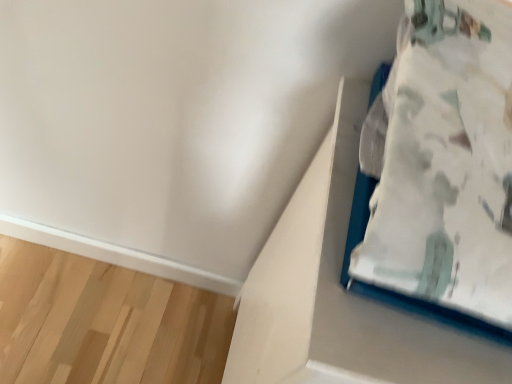
What is the approximate width of white fabric bed at upper right?

white fabric bed at upper right is 13.35 inches wide.

At what (x,y) coordinates should I click in order to perform the action: click on white fabric bed at upper right. Please return your answer as a coordinate pair (x, y). The width and height of the screenshot is (512, 384). Looking at the image, I should click on [x=444, y=166].

In order to face white fabric bed at upper right, should I rotate leftwards or rightwards?

You should rotate right by 28.398 degrees.

The height and width of the screenshot is (384, 512). Describe the element at coordinates (444, 166) in the screenshot. I see `white fabric bed at upper right` at that location.

Measure the distance between white matte cardboard box at upper right and camera.

white matte cardboard box at upper right and camera are 14.36 inches apart from each other.

This screenshot has width=512, height=384. Describe the element at coordinates (339, 294) in the screenshot. I see `white matte cardboard box at upper right` at that location.

Identify the location of white matte cardboard box at upper right. The image size is (512, 384). (339, 294).

At what (x,y) coordinates should I click in order to perform the action: click on white fabric bed at upper right. Please return your answer as a coordinate pair (x, y). The height and width of the screenshot is (384, 512). Looking at the image, I should click on (444, 166).

Based on their positions, is white fabric bed at upper right located to the left or right of white matte cardboard box at upper right?

white fabric bed at upper right is positioned on white matte cardboard box at upper right's left side.

Is the depth of white fabric bed at upper right less than that of white matte cardboard box at upper right?

A: Yes, it is in front of white matte cardboard box at upper right.

Considering the points (389, 222) and (302, 373), which point is behind, point (389, 222) or point (302, 373)?

The point (302, 373) is farther.

From the image's perspective, is white fabric bed at upper right above or below white matte cardboard box at upper right?

white fabric bed at upper right is above white matte cardboard box at upper right.

From a real-world perspective, is white fabric bed at upper right located beneath white matte cardboard box at upper right?

No, from a real-world perspective, white fabric bed at upper right is not beneath white matte cardboard box at upper right.

Considering the sizes of objects white fabric bed at upper right and white matte cardboard box at upper right in the image provided, who is thinner, white fabric bed at upper right or white matte cardboard box at upper right?

white fabric bed at upper right is thinner.

Considering the sizes of white fabric bed at upper right and white matte cardboard box at upper right in the image, is white fabric bed at upper right taller or shorter than white matte cardboard box at upper right?

Clearly, white fabric bed at upper right is shorter compared to white matte cardboard box at upper right.

Is white fabric bed at upper right bigger than white matte cardboard box at upper right?

Incorrect, white fabric bed at upper right is not larger than white matte cardboard box at upper right.

Would you say white fabric bed at upper right is outside white matte cardboard box at upper right?

Yes, white fabric bed at upper right is outside of white matte cardboard box at upper right.

Is there a large distance between white fabric bed at upper right and white matte cardboard box at upper right?

Actually, white fabric bed at upper right and white matte cardboard box at upper right are a little close together.

Could you tell me if white fabric bed at upper right is turned towards white matte cardboard box at upper right?

No, white fabric bed at upper right is not facing towards white matte cardboard box at upper right.

How different are the orientations of white fabric bed at upper right and white matte cardboard box at upper right in degrees?

The angle between the facing direction of white fabric bed at upper right and the facing direction of white matte cardboard box at upper right is 0.000792 degrees.

Identify the location of furniture on the left of white matte cardboard box at upper right. Image resolution: width=512 pixels, height=384 pixels. (444, 166).

Is white matte cardboard box at upper right to the right of white fabric bed at upper right from the viewer's perspective?

Indeed, white matte cardboard box at upper right is positioned on the right side of white fabric bed at upper right.

Which is behind, white matte cardboard box at upper right or white fabric bed at upper right?

white matte cardboard box at upper right is more distant.

Is point (316, 332) closer or farther from the camera than point (397, 259)?

Point (316, 332) appears to be farther away from the viewer than point (397, 259).

From the image's perspective, which object appears higher, white matte cardboard box at upper right or white fabric bed at upper right?

white fabric bed at upper right, from the image's perspective.

From a real-world perspective, is white matte cardboard box at upper right below white fabric bed at upper right?

Yes, from a real-world perspective, white matte cardboard box at upper right is under white fabric bed at upper right.

Can you confirm if white matte cardboard box at upper right is thinner than white fabric bed at upper right?

Incorrect, the width of white matte cardboard box at upper right is not less than that of white fabric bed at upper right.

Which of these two, white matte cardboard box at upper right or white fabric bed at upper right, stands shorter?

Standing shorter between the two is white fabric bed at upper right.

Considering the sizes of white matte cardboard box at upper right and white fabric bed at upper right in the image, is white matte cardboard box at upper right bigger or smaller than white fabric bed at upper right?

white matte cardboard box at upper right is bigger than white fabric bed at upper right.

Consider the image. Can we say white matte cardboard box at upper right lies outside white fabric bed at upper right?

Yes.

Is white matte cardboard box at upper right next to white fabric bed at upper right?

No.

Is white matte cardboard box at upper right aimed at white fabric bed at upper right?

No, white matte cardboard box at upper right does not turn towards white fabric bed at upper right.

How different are the orientations of white matte cardboard box at upper right and white fabric bed at upper right in degrees?

0.000792 degrees.

Where is `cardboard box lying on the right of white fabric bed at upper right`? This screenshot has height=384, width=512. cardboard box lying on the right of white fabric bed at upper right is located at coordinates coord(339,294).

The width and height of the screenshot is (512, 384). I want to click on furniture that appears above the white matte cardboard box at upper right (from the image's perspective), so click(444, 166).

At what (x,y) coordinates should I click in order to perform the action: click on cardboard box behind the white fabric bed at upper right. Please return your answer as a coordinate pair (x, y). This screenshot has height=384, width=512. Looking at the image, I should click on (339, 294).